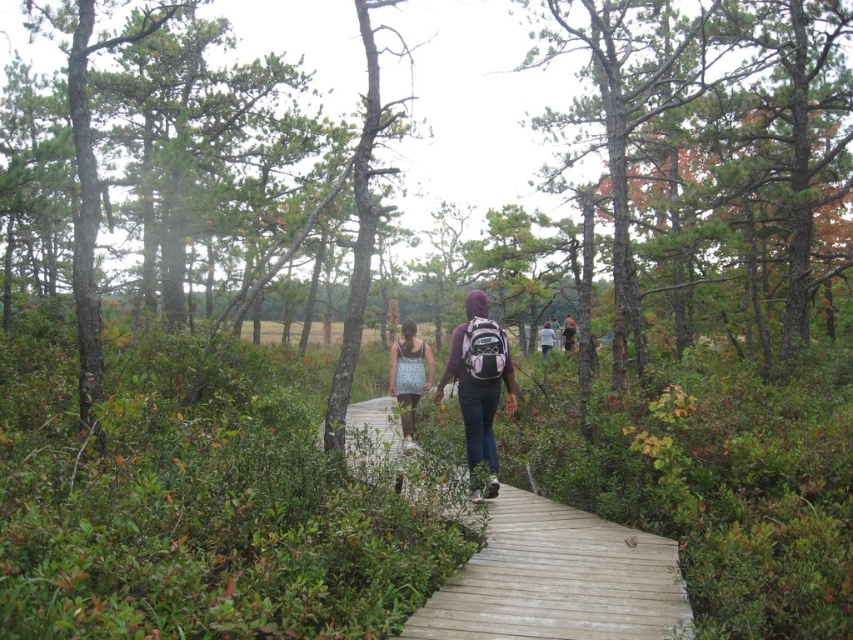
Question: Which object is the farthest from the purple fleece jacket at center?

Choices:
 (A) wooden at center
 (B) pink backpack at center
 (C) patterned fabric dress at center

Answer: (B)

Question: Which object is the closest to the pink backpack at center?

Choices:
 (A) wooden at center
 (B) patterned fabric dress at center
 (C) purple fleece jacket at center

Answer: (B)

Question: Does wooden at center come behind pink backpack at center?

Choices:
 (A) yes
 (B) no

Answer: (B)

Question: Is purple fleece jacket at center smaller than patterned fabric dress at center?

Choices:
 (A) no
 (B) yes

Answer: (A)

Question: Which object is positioned farthest from the pink backpack at center?

Choices:
 (A) patterned fabric dress at center
 (B) purple fleece jacket at center
 (C) wooden at center

Answer: (C)

Question: Can you confirm if patterned fabric dress at center is thinner than pink backpack at center?

Choices:
 (A) no
 (B) yes

Answer: (A)